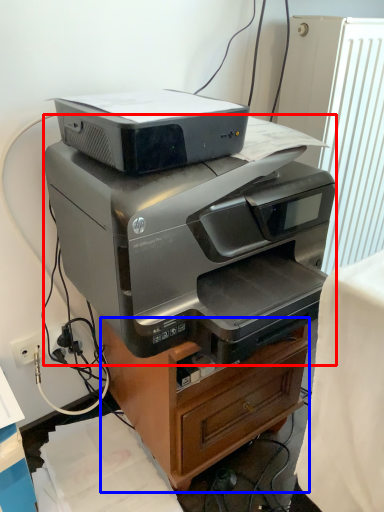
Question: Which object appears farthest to the camera in this image, printer (highlighted by a red box) or furniture (highlighted by a blue box)?

Choices:
 (A) printer
 (B) furniture

Answer: (B)